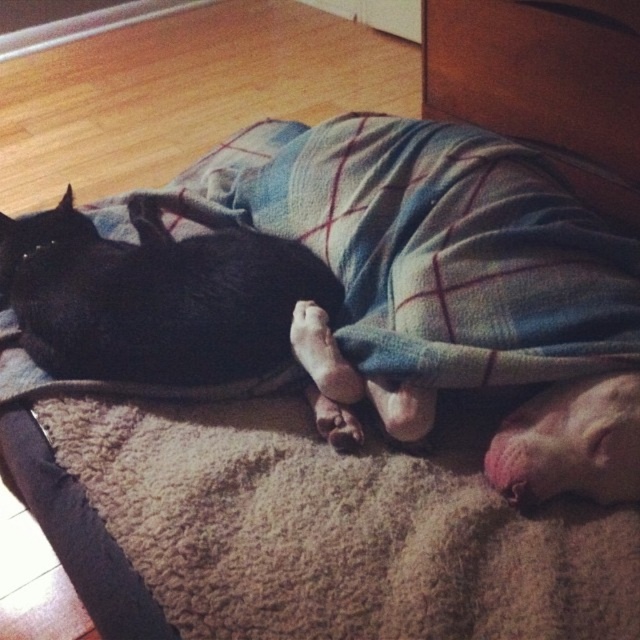
Question: Does plaid fabric blanket at center come in front of wooden drawer at upper center?

Choices:
 (A) no
 (B) yes

Answer: (B)

Question: Which point is farther from the camera taking this photo?

Choices:
 (A) (477, 99)
 (B) (177, 317)

Answer: (A)

Question: Is the position of plaid fabric blanket at center more distant than that of wooden drawer at upper center?

Choices:
 (A) no
 (B) yes

Answer: (A)

Question: In this image, where is plaid fabric blanket at center located relative to wooden drawer at upper center?

Choices:
 (A) right
 (B) left

Answer: (B)

Question: Which object appears farthest from the camera in this image?

Choices:
 (A) wooden drawer at upper center
 (B) plaid fabric blanket at center
 (C) black fur cat at left

Answer: (A)

Question: Based on their relative distances, which object is farther from the black fur cat at left?

Choices:
 (A) wooden drawer at upper center
 (B) plaid fabric blanket at center

Answer: (A)